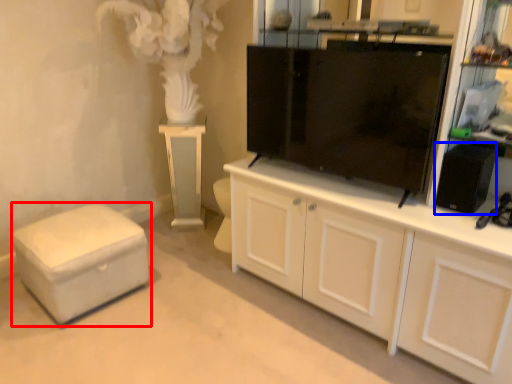
Question: Which object appears farthest to the camera in this image, furniture (highlighted by a red box) or appliance (highlighted by a blue box)?

Choices:
 (A) furniture
 (B) appliance

Answer: (A)